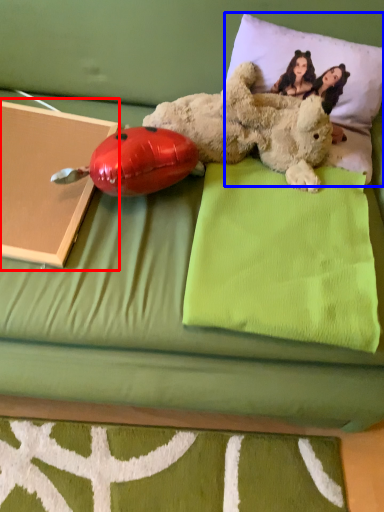
Question: Which point is closer to the camera, paperback book (highlighted by a red box) or pillow (highlighted by a blue box)?

Choices:
 (A) paperback book
 (B) pillow

Answer: (A)